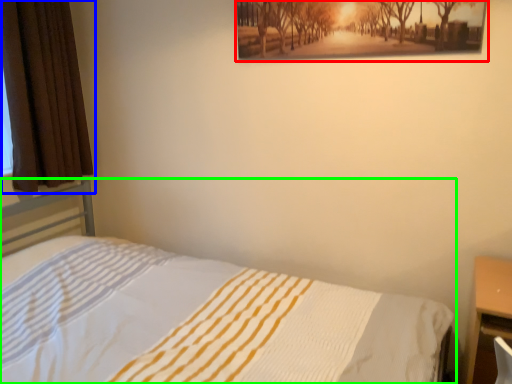
Question: Which object is the closest to the picture frame (highlighted by a red box)? Choose among these: curtain (highlighted by a blue box) or bed (highlighted by a green box).

Choices:
 (A) curtain
 (B) bed

Answer: (B)